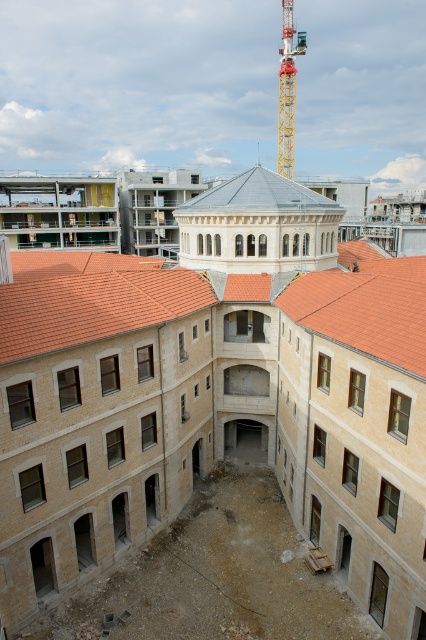
Question: Does beige stone construction site at center have a larger size compared to brown tile roof at lower left?

Choices:
 (A) yes
 (B) no

Answer: (A)

Question: Which object is positioned closest to the yellow metallic crane at upper center?

Choices:
 (A) orange tile roof at center
 (B) brown tile roof at lower left
 (C) beige stone construction site at center

Answer: (C)

Question: Which of these objects is positioned farthest from the beige stone construction site at center?

Choices:
 (A) smooth gray dome at center
 (B) brown tile roof at lower left
 (C) orange tile roof at center
 (D) yellow metallic crane at upper center

Answer: (D)

Question: Which object is closer to the camera taking this photo?

Choices:
 (A) brown tile roof at lower left
 (B) beige stone construction site at center

Answer: (B)

Question: Can you confirm if beige stone construction site at center is smaller than yellow metallic crane at upper center?

Choices:
 (A) no
 (B) yes

Answer: (B)

Question: Can you confirm if brown tile roof at lower left is thinner than yellow metallic crane at upper center?

Choices:
 (A) no
 (B) yes

Answer: (B)